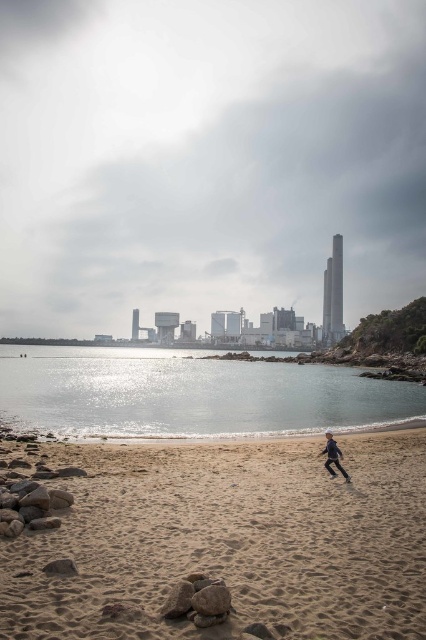
Question: Is clear water at center further to the viewer compared to dark blue fabric person at lower right?

Choices:
 (A) yes
 (B) no

Answer: (A)

Question: Which of the following is the farthest from the observer?

Choices:
 (A) (328, 449)
 (B) (39, 401)
 (C) (195, 522)

Answer: (B)

Question: Considering the real-world distances, which object is farthest from the clear water at center?

Choices:
 (A) dark blue fabric person at lower right
 (B) sandy beach at lower center
 (C) smooth gray rock at lower center

Answer: (A)

Question: Does clear water at center appear under dark blue fabric person at lower right?

Choices:
 (A) yes
 (B) no

Answer: (A)

Question: Observing the image, what is the correct spatial positioning of smooth gray rock at lower center in reference to dark blue fabric person at lower right?

Choices:
 (A) above
 (B) below

Answer: (A)

Question: Which point is closer to the camera taking this photo?

Choices:
 (A) (226, 593)
 (B) (328, 467)
 (C) (374, 412)

Answer: (A)